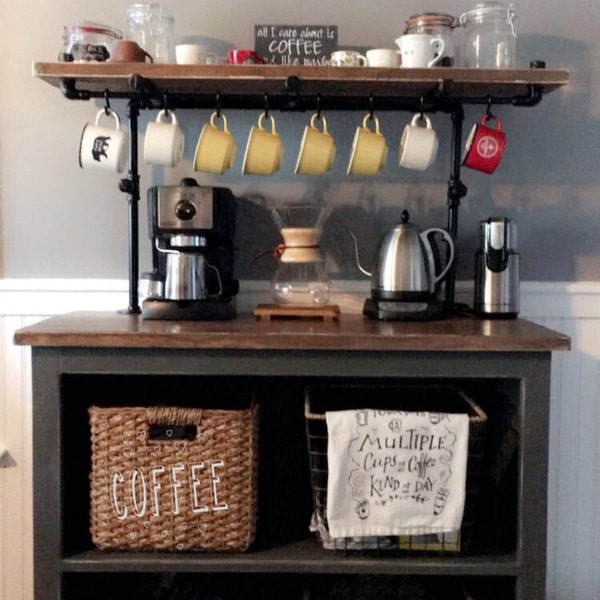
Image resolution: width=600 pixels, height=600 pixels. Find the location of `kettle`. kettle is located at coordinates (400, 251).